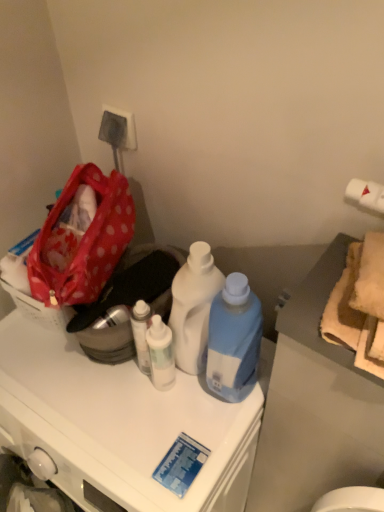
Find the location of a particular element. This screenshot has width=384, height=512. free space above white glossy cabinet at center (from a real-world perspective) is located at coordinates click(94, 396).